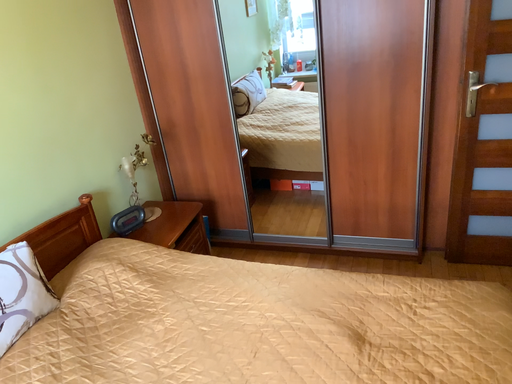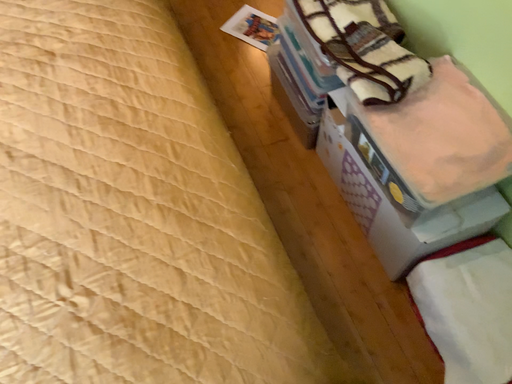
Question: How did the camera likely rotate when shooting the video?

Choices:
 (A) rotated downward
 (B) rotated upward

Answer: (A)